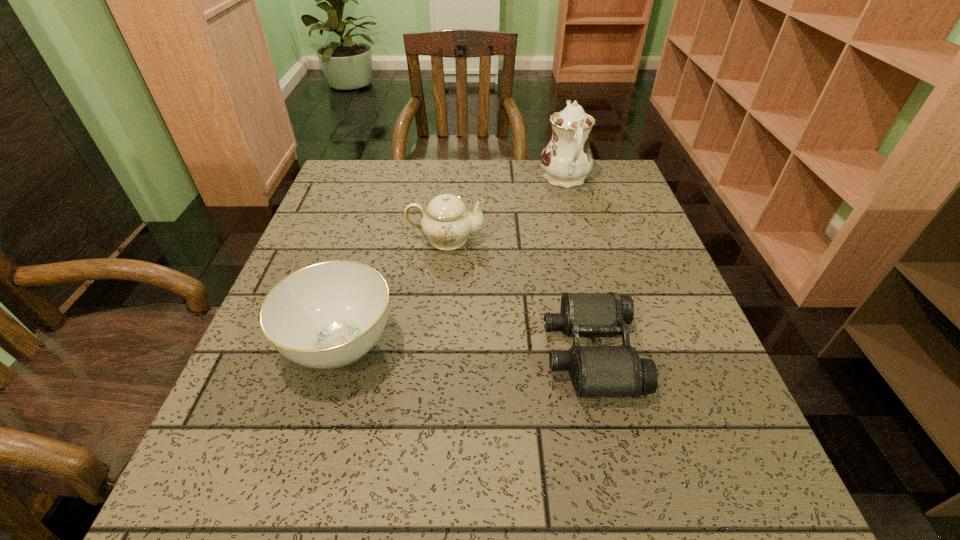
Locate an element on the screen. empty space that is in between the second nearest chinaware and the shortest object is located at coordinates (518, 295).

What are the coordinates of `free space that is in between the rightmost chinaware and the nearest chinaware` in the screenshot? It's located at (452, 262).

Identify the location of vacant space in between the nearest chinaware and the binoculars. This screenshot has width=960, height=540. (466, 349).

Locate an element on the screen. The image size is (960, 540). object identified as the closest to the tallest chinaware is located at coordinates (447, 222).

Where is `the second closest object relative to the binoculars`? The height and width of the screenshot is (540, 960). the second closest object relative to the binoculars is located at coordinates (328, 315).

Select which chinaware is the third closest to the shortest object. Please provide its 2D coordinates. Your answer should be formatted as a tuple, i.e. [(x, y)], where the tuple contains the x and y coordinates of a point satisfying the conditions above.

[(567, 159)]

You are a GUI agent. You are given a task and a screenshot of the screen. Output one action in this format:
    pyautogui.click(x=<x>, y=<y>)
    Task: Click on the chinaware that stands as the second closest to the farthest object
    
    Given the screenshot: What is the action you would take?
    pyautogui.click(x=328, y=315)